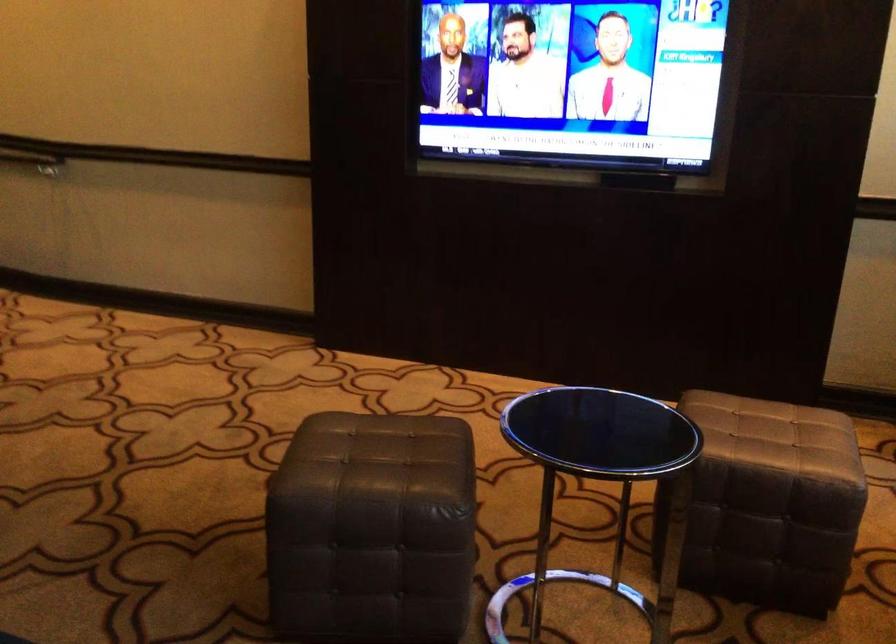
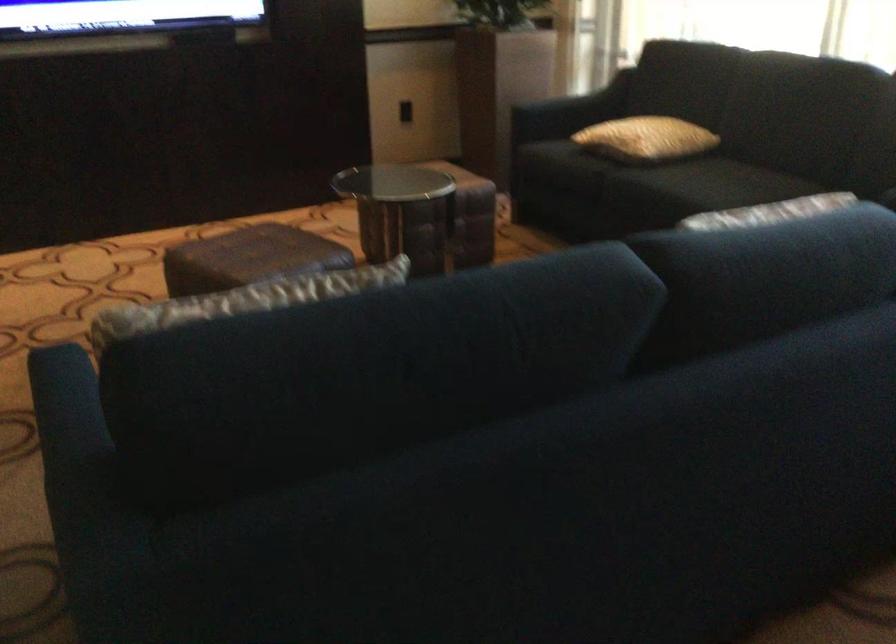
Where in the second image is the point corresponding to [339,451] from the first image?

(248, 258)